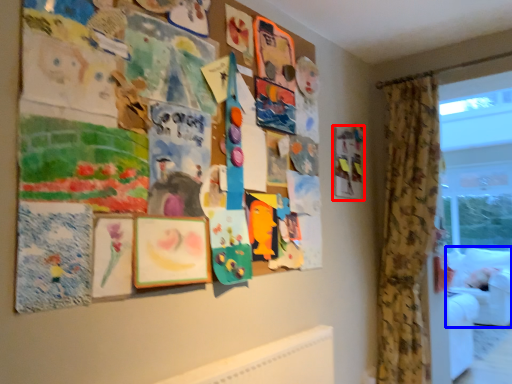
Question: Which object is closer to the camera taking this photo, picture frame (highlighted by a red box) or couch (highlighted by a blue box)?

Choices:
 (A) picture frame
 (B) couch

Answer: (A)